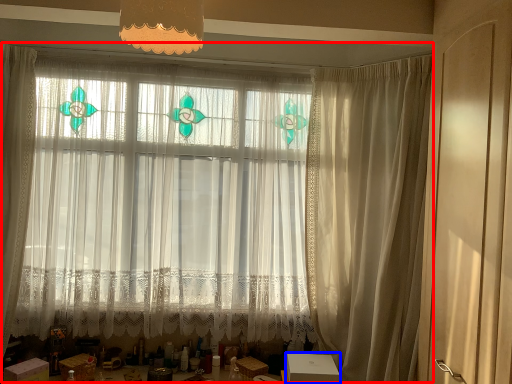
Question: Which point is closer to the camera, curtain (highlighted by a red box) or cardboard box (highlighted by a blue box)?

Choices:
 (A) curtain
 (B) cardboard box

Answer: (B)